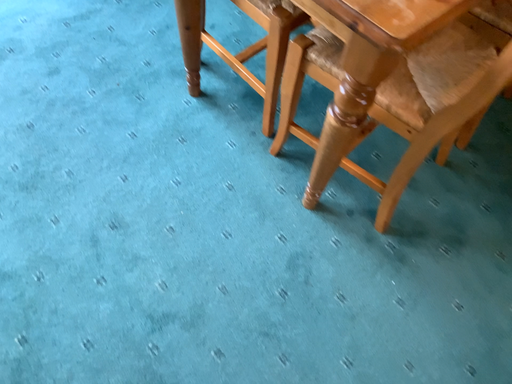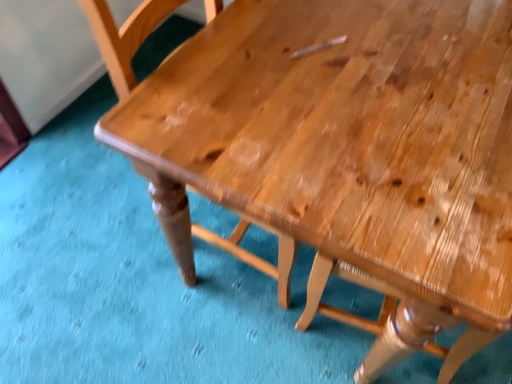
Question: How did the camera likely rotate when shooting the video?

Choices:
 (A) rotated downward
 (B) rotated upward

Answer: (B)